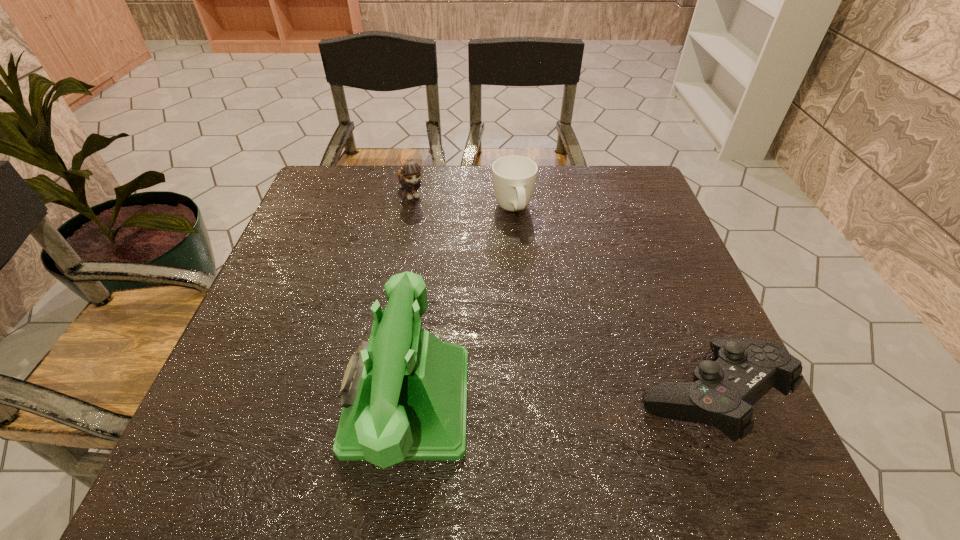
I want to click on vacant space located on the front-facing side of the kitten, so click(440, 255).

At what (x,y) coordinates should I click in order to perform the action: click on vacant space located with the handle on the side of the third object from left to right. Please return your answer as a coordinate pair (x, y). This screenshot has height=540, width=960. Looking at the image, I should click on (526, 252).

Identify the location of free space located 0.340m with the handle on the side of the third object from left to right. (553, 333).

You are a GUI agent. You are given a task and a screenshot of the screen. Output one action in this format:
    pyautogui.click(x=<x>, y=<y>)
    Task: Click on the vacant point located with the handle on the side of the third object from left to right
    Image resolution: width=960 pixels, height=540 pixels.
    Given the screenshot: What is the action you would take?
    pyautogui.click(x=548, y=318)

Image resolution: width=960 pixels, height=540 pixels. Identify the location of kitten that is at the far edge. (409, 176).

Find the location of a particular element. The height and width of the screenshot is (540, 960). cup positioned at the far edge is located at coordinates (514, 177).

Locate an element on the screen. Image resolution: width=960 pixels, height=540 pixels. telephone that is at the near edge is located at coordinates (404, 393).

You are a GUI agent. You are given a task and a screenshot of the screen. Output one action in this format:
    pyautogui.click(x=<x>, y=<y>)
    Task: Click on the control present at the near edge
    The width and height of the screenshot is (960, 540).
    Given the screenshot: What is the action you would take?
    pyautogui.click(x=722, y=393)

Where is `object at the right edge`? The width and height of the screenshot is (960, 540). object at the right edge is located at coordinates (722, 393).

I want to click on object located at the near right corner, so click(722, 393).